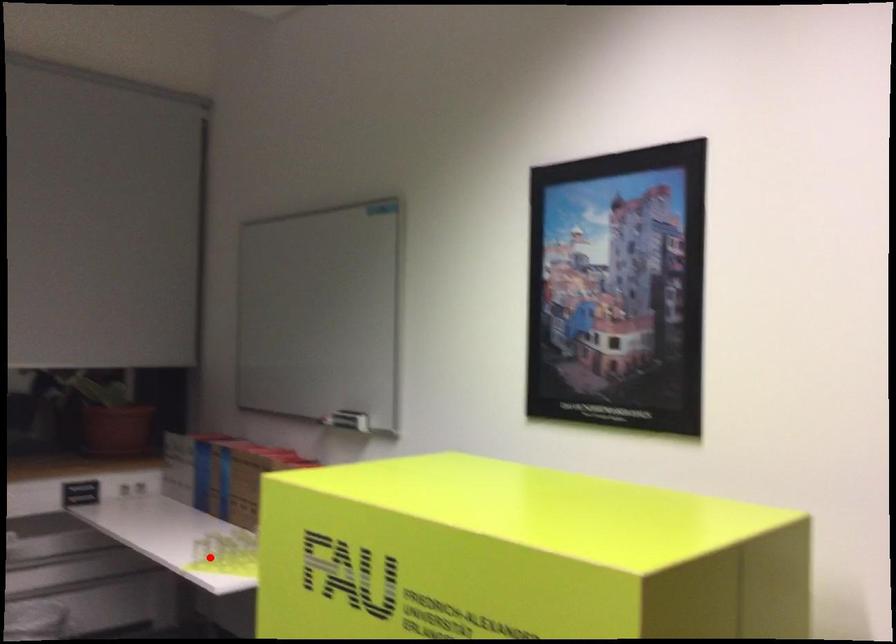
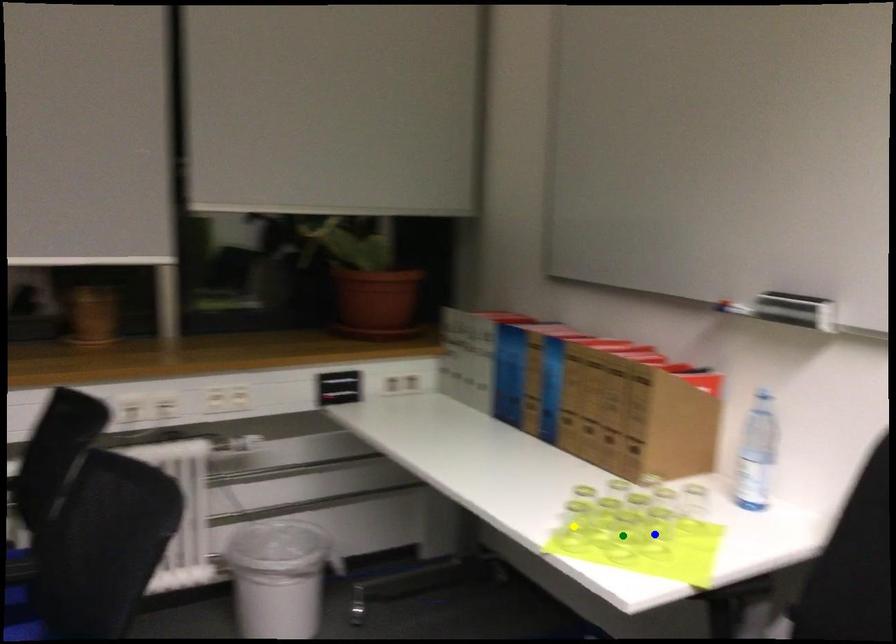
Question: I am providing you with two images of the same scene from different viewpoints. A red point is marked on the first image. You are given multiple points on the second image. Which point in image 2 is actually the same real-world point as the red point in image 1?

Choices:
 (A) green point
 (B) yellow point
 (C) blue point

Answer: (B)